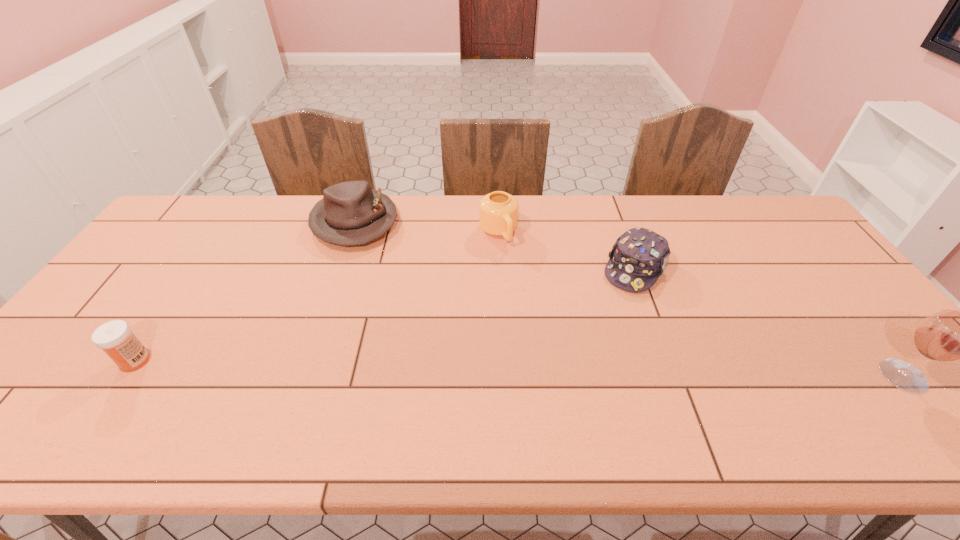
This screenshot has height=540, width=960. Find the location of `medicine`. medicine is located at coordinates (115, 338).

The image size is (960, 540). I want to click on the tallest object, so click(948, 335).

This screenshot has width=960, height=540. I want to click on the rightmost object, so click(948, 335).

Where is `mug`? mug is located at coordinates (498, 211).

Locate an element on the screen. the fourth object from right to left is located at coordinates (351, 213).

Find the location of a particular element. The height and width of the screenshot is (540, 960). headwear is located at coordinates 638,258.

Identify the location of vacant space located on the back of the medicine. (179, 297).

Identify the location of vacant space located on the left of the wineglass. Image resolution: width=960 pixels, height=540 pixels. (743, 376).

Identify the location of vacant space located 0.370m on the handle side of the third object from left to right. (557, 336).

At what (x,y) coordinates should I click in order to perform the action: click on free space located on the handle side of the third object from left to right. Please return your answer as a coordinate pair (x, y). This screenshot has width=960, height=540. Looking at the image, I should click on (526, 284).